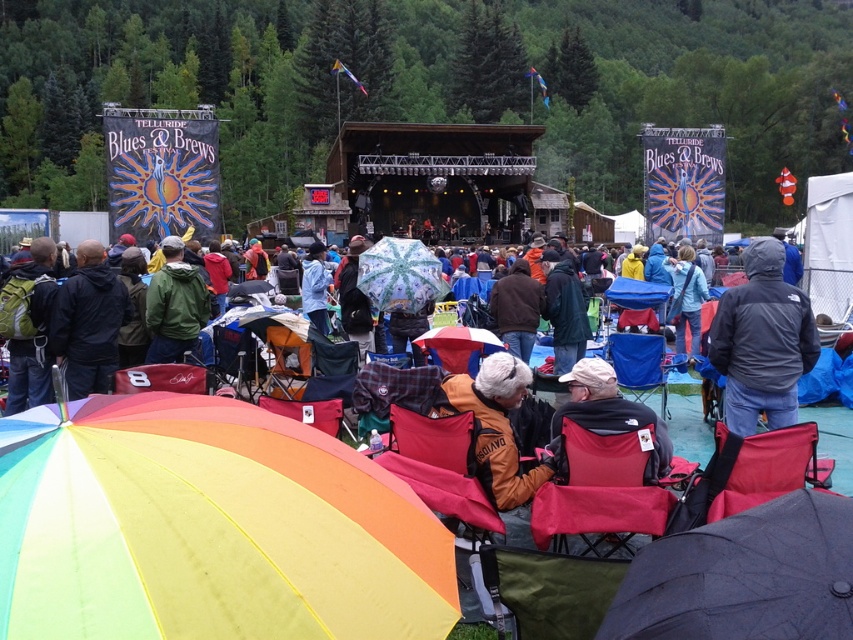
Locate an element on the screen. The height and width of the screenshot is (640, 853). dark gray waterproof jacket at center is located at coordinates (762, 340).

Looking at this image, is dark gray waterproof jacket at center wider than green fabric chair at lower center?

No.

Does point (776, 397) lie behind point (547, 579)?

Yes, point (776, 397) is behind point (547, 579).

What are the coordinates of `dark gray waterproof jacket at center` in the screenshot? It's located at (762, 340).

Is dark gray waterproof jacket at center positioned before dark green jacket at center?

Yes, dark gray waterproof jacket at center is closer to the viewer.

Is dark gray waterproof jacket at center to the left of dark green jacket at center from the viewer's perspective?

Incorrect, dark gray waterproof jacket at center is not on the left side of dark green jacket at center.

The width and height of the screenshot is (853, 640). What do you see at coordinates (762, 340) in the screenshot? I see `dark gray waterproof jacket at center` at bounding box center [762, 340].

This screenshot has height=640, width=853. What are the coordinates of `dark gray waterproof jacket at center` in the screenshot? It's located at [x=762, y=340].

Does point (198, 326) come farther from viewer compared to point (321, 269)?

No, it is in front of (321, 269).

Which is in front, point (164, 280) or point (306, 308)?

Point (164, 280) is more forward.

At what (x,y) coordinates should I click in order to perform the action: click on green matte jacket at center. Please return your answer as a coordinate pair (x, y). Looking at the image, I should click on (173, 305).